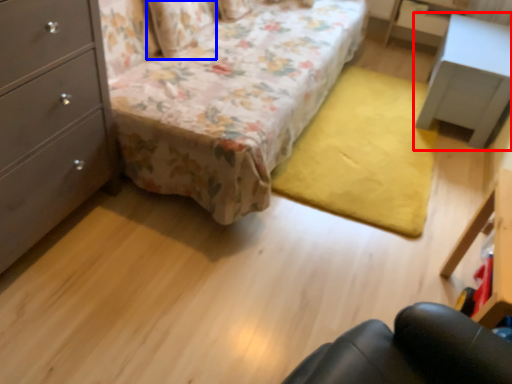
Question: Which of the following is the farthest to the observer, nightstand (highlighted by a red box) or pillow (highlighted by a blue box)?

Choices:
 (A) nightstand
 (B) pillow

Answer: (A)